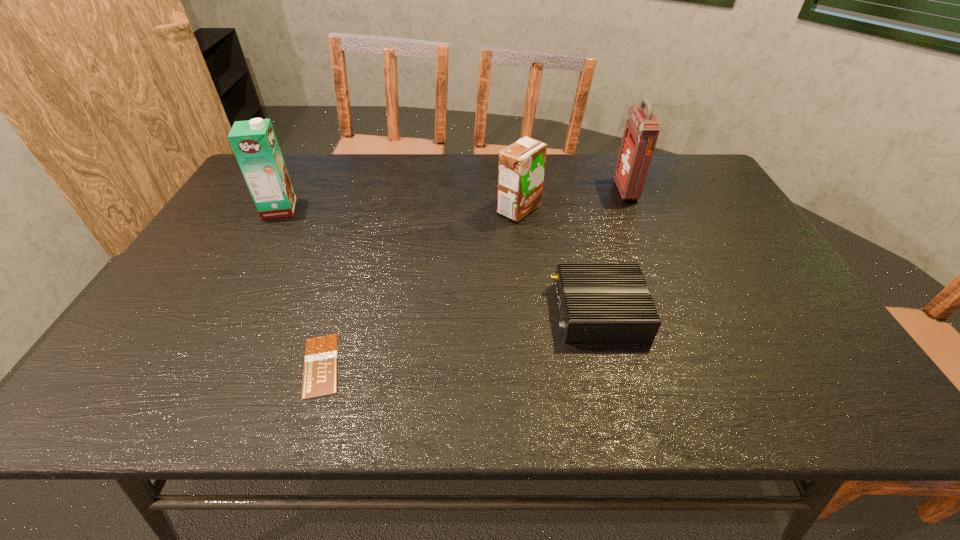
What are the coordinates of `the first-aid kit` in the screenshot? It's located at (642, 128).

Find the location of a particular element. the taller carton is located at coordinates (254, 142).

This screenshot has height=540, width=960. What are the coordinates of `the left carton` in the screenshot? It's located at (254, 142).

Image resolution: width=960 pixels, height=540 pixels. What are the coordinates of `the shorter carton` in the screenshot? It's located at (521, 168).

At what (x,y) coordinates should I click in order to perform the action: click on the right carton. Please return your answer as a coordinate pair (x, y). Image resolution: width=960 pixels, height=540 pixels. Looking at the image, I should click on (521, 168).

Image resolution: width=960 pixels, height=540 pixels. I want to click on the second shortest object, so click(598, 302).

At what (x,y) coordinates should I click in order to perform the action: click on the second object from left to right. Please return your answer as a coordinate pair (x, y). Image resolution: width=960 pixels, height=540 pixels. Looking at the image, I should click on (320, 365).

This screenshot has height=540, width=960. Find the location of `chocolate bar`. chocolate bar is located at coordinates (320, 365).

Where is `free location located on the front-facing side of the first-aid kit`? This screenshot has height=540, width=960. free location located on the front-facing side of the first-aid kit is located at coordinates click(541, 191).

Identify the location of free space located 0.180m on the front-facing side of the first-aid kit. This screenshot has height=540, width=960. (561, 191).